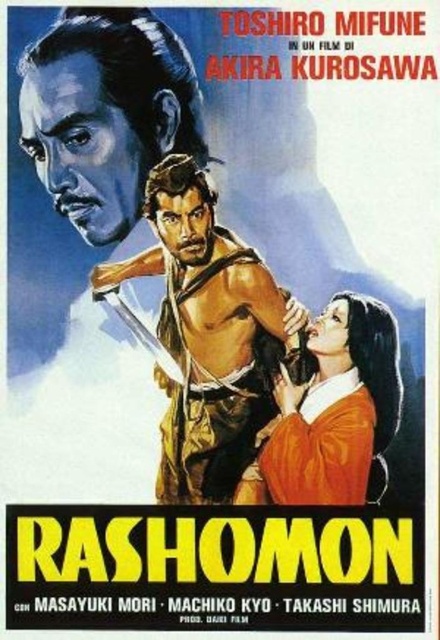
Question: Is matte black face at upper left to the right of smooth orange kimono at lower right from the viewer's perspective?

Choices:
 (A) yes
 (B) no

Answer: (B)

Question: Which point is farther to the camera?

Choices:
 (A) brown leather armor at center
 (B) smooth orange kimono at lower right

Answer: (B)

Question: Does brown leather armor at center appear under matte black face at upper left?

Choices:
 (A) no
 (B) yes

Answer: (B)

Question: Observing the image, what is the correct spatial positioning of matte black face at upper left in reference to smooth orange kimono at lower right?

Choices:
 (A) left
 (B) right

Answer: (A)

Question: Which point is closer to the camera?

Choices:
 (A) matte black face at upper left
 (B) brown leather armor at center

Answer: (B)

Question: Which point is farther from the camera taking this photo?

Choices:
 (A) (278, 454)
 (B) (83, 35)
 (C) (161, 452)

Answer: (B)